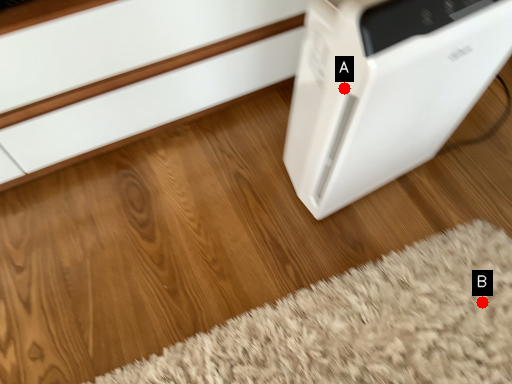
Question: Two points are circled on the image, labeled by A and B beside each circle. Among these points, which one is farthest from the camera?

Choices:
 (A) A is further
 (B) B is further

Answer: (B)